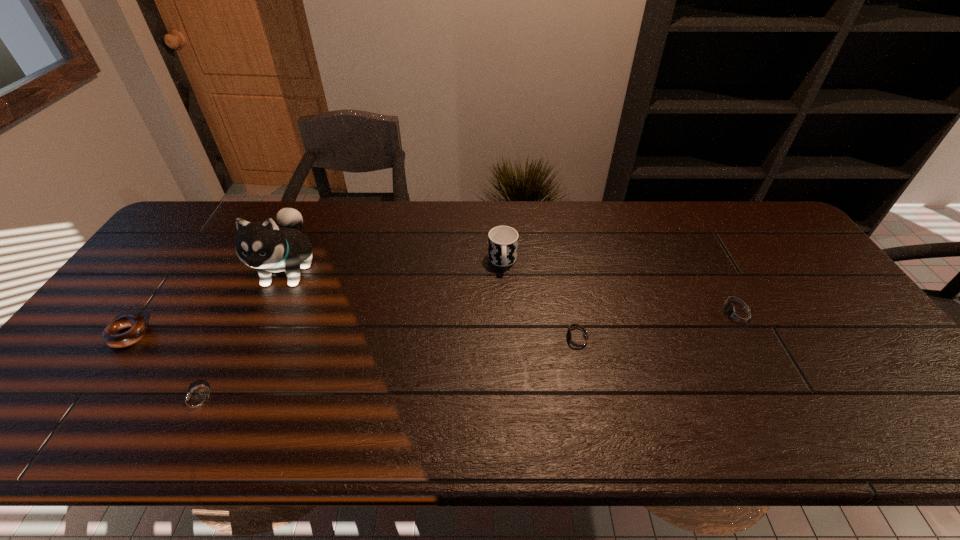
The image size is (960, 540). I want to click on free space between the leftmost object and the second tallest object, so click(316, 298).

At what (x,y) coordinates should I click in order to perform the action: click on empty space that is in between the doughnut and the rightmost watch. Please return your answer as a coordinate pair (x, y). This screenshot has width=960, height=540. Looking at the image, I should click on (433, 325).

I want to click on free space between the second tallest watch and the puppy, so point(432,304).

The image size is (960, 540). Find the location of `unoccupied position between the tallest watch and the tallest object`. unoccupied position between the tallest watch and the tallest object is located at coordinates (513, 292).

In order to click on free space between the doughnut and the puppy in this screenshot , I will do `click(208, 302)`.

I want to click on free space between the fifth shortest object and the shortest watch, so click(x=350, y=330).

In order to click on vacant space that is in between the rightmost object and the shortest object in this screenshot , I will do `click(468, 357)`.

The width and height of the screenshot is (960, 540). Find the location of `unoccupied area between the doughnut and the third object from right to left`. unoccupied area between the doughnut and the third object from right to left is located at coordinates (316, 298).

Where is `free space between the doughnut and the cup`? The height and width of the screenshot is (540, 960). free space between the doughnut and the cup is located at coordinates (316, 298).

Where is `object that is the fourth closest to the second tallest object`? The image size is (960, 540). object that is the fourth closest to the second tallest object is located at coordinates (196, 401).